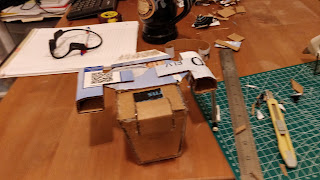
Find the location of `paper pad`. paper pad is located at coordinates (29, 52).